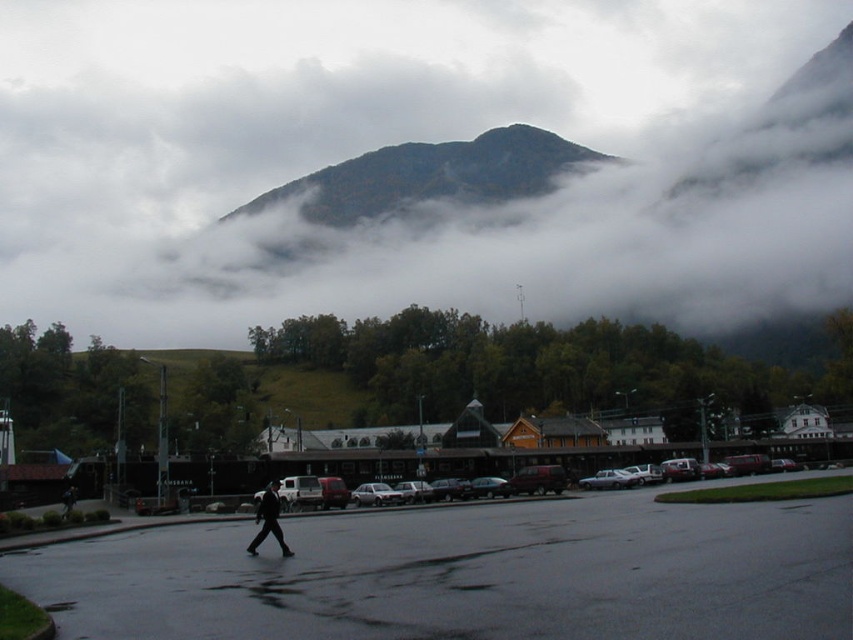
You are a hiker planning to take a photo of the white fluffy cloud at upper center and the green forested mountain at upper center. Which object should you focus on first if you want both to be in focus without adjusting the camera settings?

You should focus on the green forested mountain at upper center first because it is closer to you than the white fluffy cloud at upper center, allowing both to be in focus without adjusting the camera settings.

Consider the image. You are a photographer trying to capture both the matte black car at center and the silver metallic sedan at center in the same frame. Which car should you position closer to the left side of your camera viewfinder to ensure both are visible?

To ensure both the matte black car at center and the silver metallic sedan at center are visible, you should position the silver metallic sedan at center closer to the left side of your camera viewfinder since the matte black car at center is on its right side.

You are standing at the point labeled point (309, 461) and want to walk to the point labeled point (354, 488). Given the mountainous terrain and the paved area in the scene, which direction should you head to reach your destination?

Since point (309, 461) is in front of point (354, 488), you should walk backward or behind your current position to reach point (354, 488).